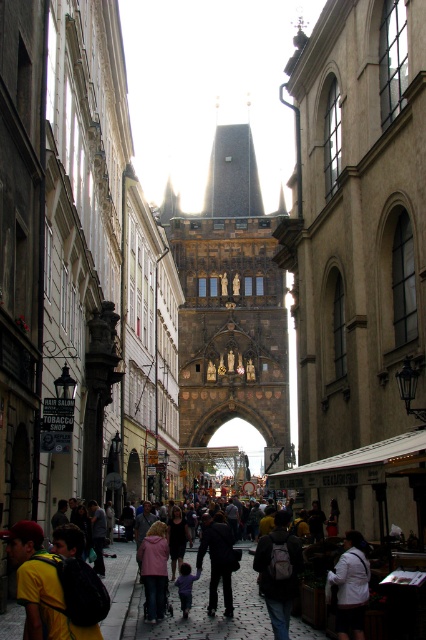
Which is below, dark brown stone tower at center or matte black backpack at center?

matte black backpack at center

Measure the distance between dark brown stone tower at center and camera.

A distance of 557.39 feet exists between dark brown stone tower at center and camera.

Where is `dark brown stone tower at center`? dark brown stone tower at center is located at coordinates (230, 305).

Between matte black backpack at center and white fabric jacket at center, which one has less height?

With less height is white fabric jacket at center.

Does point (275, 557) lie behind point (347, 625)?

Yes, it is behind point (347, 625).

This screenshot has height=640, width=426. Identify the location of matte black backpack at center. (279, 572).

Image resolution: width=426 pixels, height=640 pixels. What do you see at coordinates (230, 305) in the screenshot?
I see `dark brown stone tower at center` at bounding box center [230, 305].

Between dark brown stone tower at center and dark blue jeans at center, which one is positioned lower?

dark blue jeans at center is below.

Find the location of a particular element. The height and width of the screenshot is (640, 426). dark brown stone tower at center is located at coordinates (230, 305).

Where is `dark brown stone tower at center`? The height and width of the screenshot is (640, 426). dark brown stone tower at center is located at coordinates (230, 305).